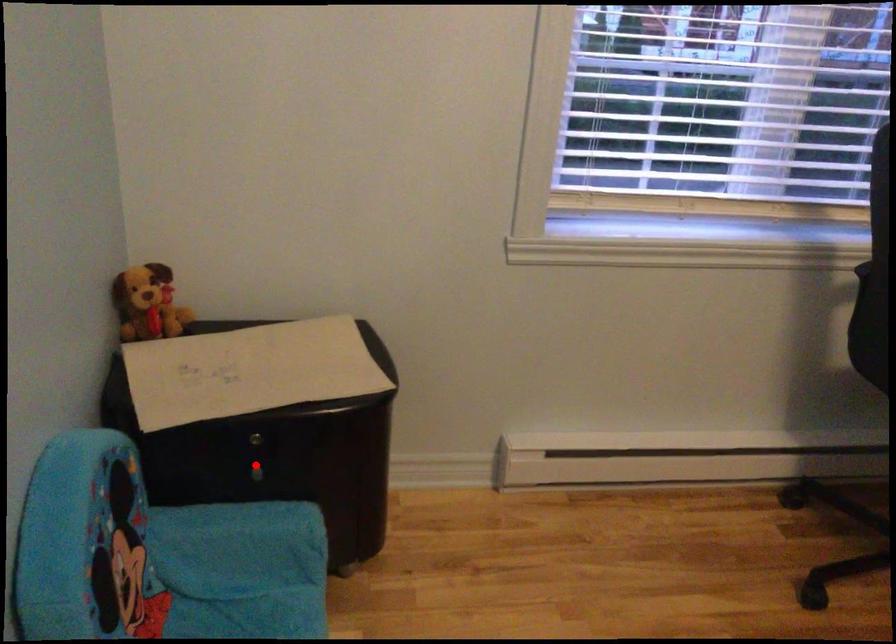
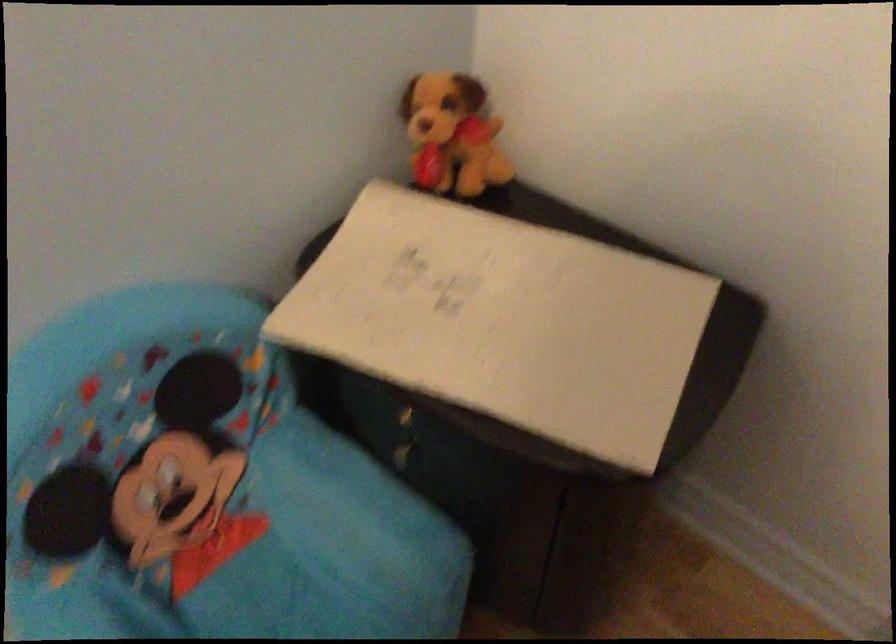
Where in the second image is the point corresponding to the highlighted location from the first image?

(403, 438)